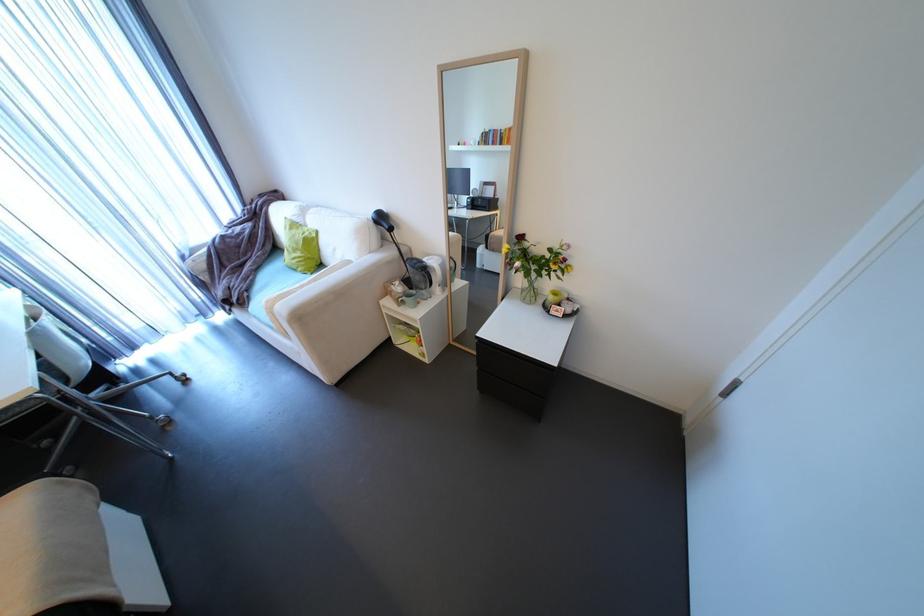
Find where to lean the white sofa armrest. Please return your answer as a coordinate pair (x, y).

(298, 289)